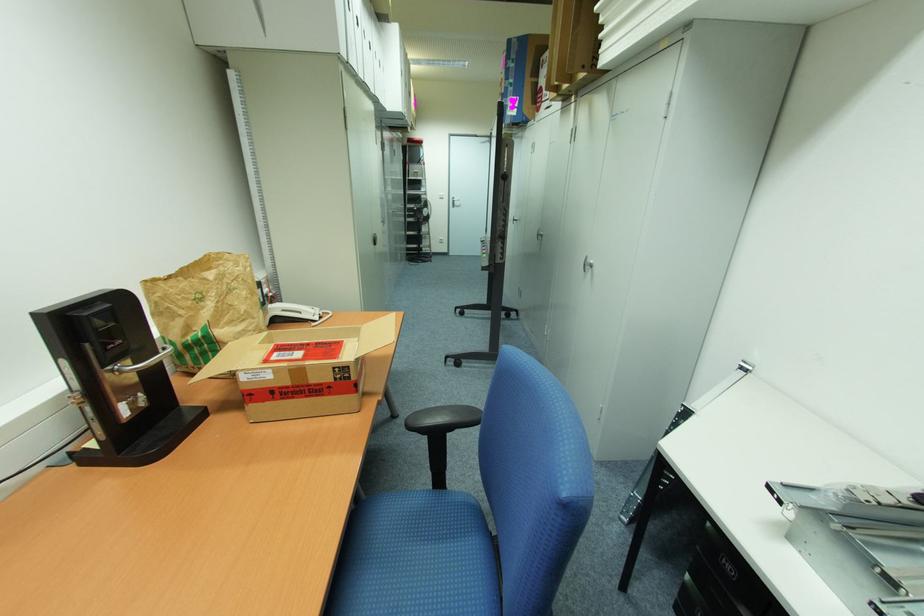
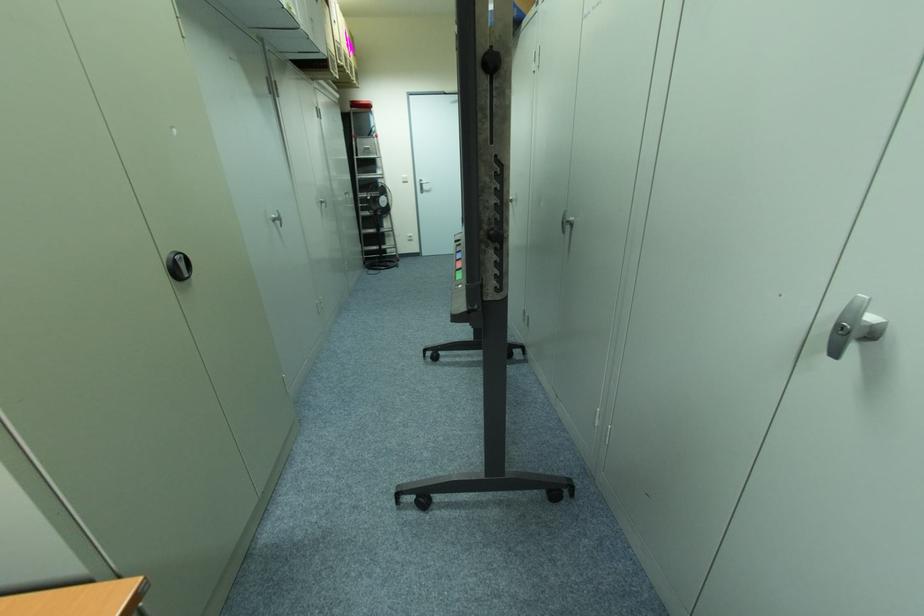
Find the pixel in the second image that matches point 542,233 in the first image.

(572, 219)